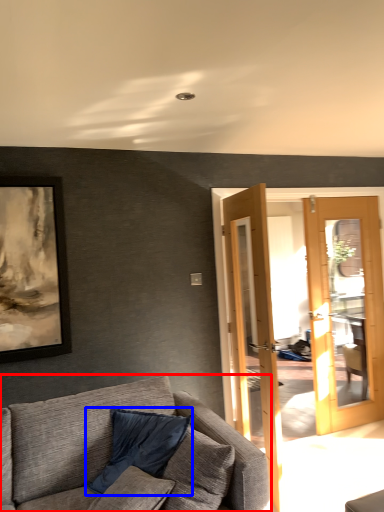
Question: Which object appears closest to the camera in this image, studio couch (highlighted by a red box) or pillow (highlighted by a blue box)?

Choices:
 (A) studio couch
 (B) pillow

Answer: (A)